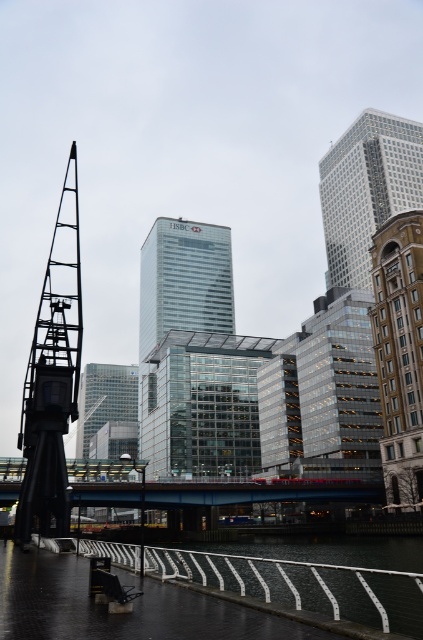
Question: Which point appears closest to the camera in this image?

Choices:
 (A) (321, 177)
 (B) (409, 332)
 (C) (76, 196)

Answer: (C)

Question: Is gold textured building at center behind glassy skyscraper at upper right?

Choices:
 (A) yes
 (B) no

Answer: (B)

Question: Which object appears closest to the camera in this image?

Choices:
 (A) glassy skyscraper at center
 (B) black metal crane at left

Answer: (B)

Question: Which of the following is the closest to the observer?

Choices:
 (A) glassy skyscraper at center
 (B) black metal crane at left
 (C) clear glass skyscraper at center

Answer: (B)

Question: Does glassy skyscraper at center have a greater width compared to clear glass skyscraper at center?

Choices:
 (A) yes
 (B) no

Answer: (A)

Question: In this image, where is gold textured building at center located relative to clear glass skyscraper at center?

Choices:
 (A) left
 (B) right

Answer: (B)